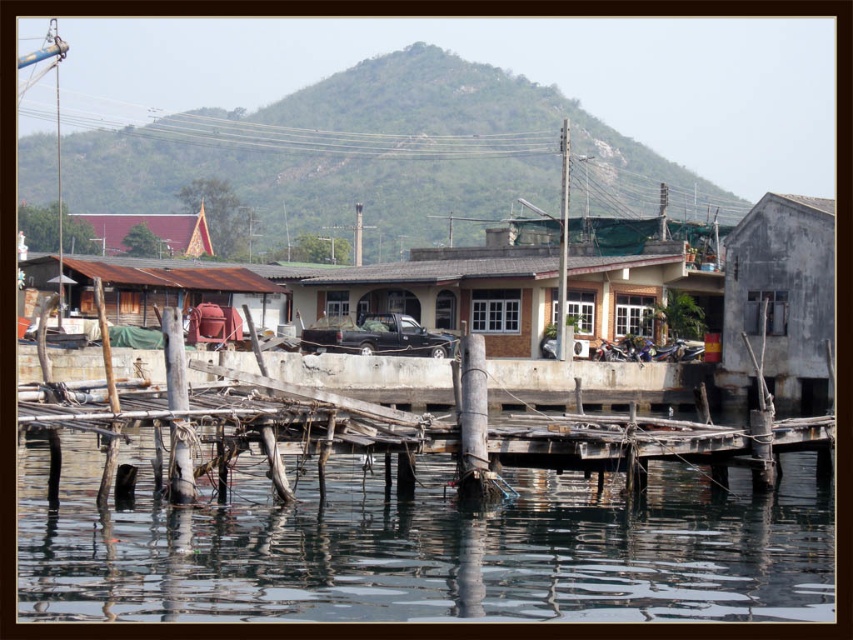
In the scene shown: You are standing at the point marked as point (428, 548). What is the nearest object to you in the scene?

The nearest object to you at point (428, 548) is the transparent water at lower center since it is located exactly at that coordinate.

You are standing at the point closer to the camera in the waterfront scene. Which point are you at, point (358, 616) or point (477, 410)?

You are at point (358, 616) because it is in front of point (477, 410).